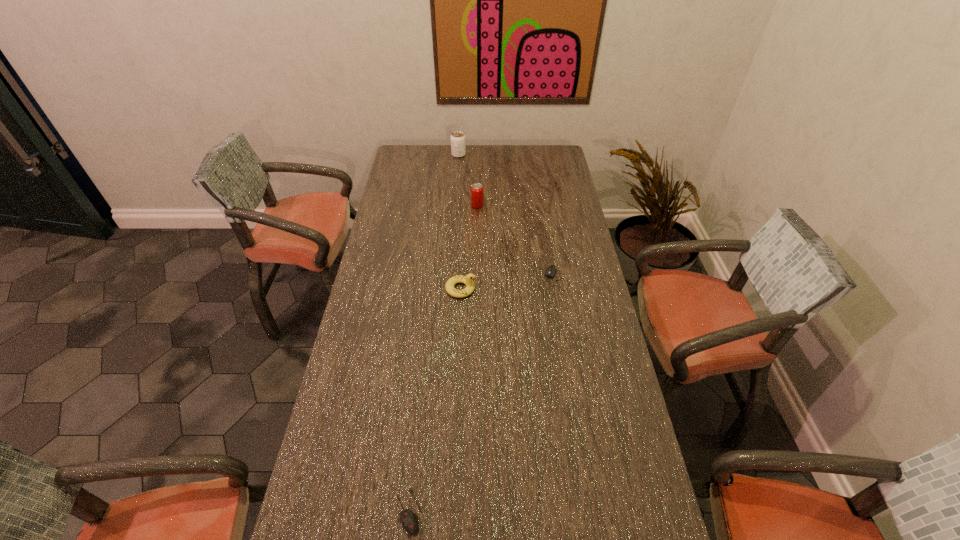
You are a GUI agent. You are given a task and a screenshot of the screen. Output one action in this format:
    pyautogui.click(x=<x>, y=<y>)
    Task: Click on the free spot between the third tallest object and the can
    Image resolution: width=960 pixels, height=540 pixels.
    Given the screenshot: What is the action you would take?
    pyautogui.click(x=469, y=247)

Identify the location of free area in between the third shortest object and the farthest object. (460, 222).

You are a GUI agent. You are given a task and a screenshot of the screen. Output one action in this format:
    pyautogui.click(x=<x>, y=<y>)
    Task: Click on the vacant area that lies between the farther mouse and the left mouse
    This screenshot has height=540, width=960.
    Given the screenshot: What is the action you would take?
    pyautogui.click(x=483, y=394)

Find the location of a particular element. free space between the can and the soda can is located at coordinates (468, 180).

Image resolution: width=960 pixels, height=540 pixels. I want to click on vacant space that is in between the right mouse and the duckling, so click(x=509, y=284).

The width and height of the screenshot is (960, 540). I want to click on free spot between the can and the soda can, so click(x=468, y=180).

You are a GUI agent. You are given a task and a screenshot of the screen. Output one action in this format:
    pyautogui.click(x=<x>, y=<y>)
    Task: Click on the empty location between the farthest object and the rightmost object
    
    Given the screenshot: What is the action you would take?
    pyautogui.click(x=508, y=217)

Select which object is the fourth closest to the third tallest object. Please provide its 2D coordinates. Your answer should be formatted as a tuple, i.e. [(x, y)], where the tuple contains the x and y coordinates of a point satisfying the conditions above.

[(458, 146)]

Locate which object ranks third in proximity to the third shortest object. Please provide its 2D coordinates. Your answer should be formatted as a tuple, i.e. [(x, y)], where the tuple contains the x and y coordinates of a point satisfying the conditions above.

[(409, 519)]

Locate an element on the screen. The image size is (960, 540). free space that satisfies the following two spatial constraints: 1. on the front side of the can; 2. on the right side of the farther mouse is located at coordinates (477, 279).